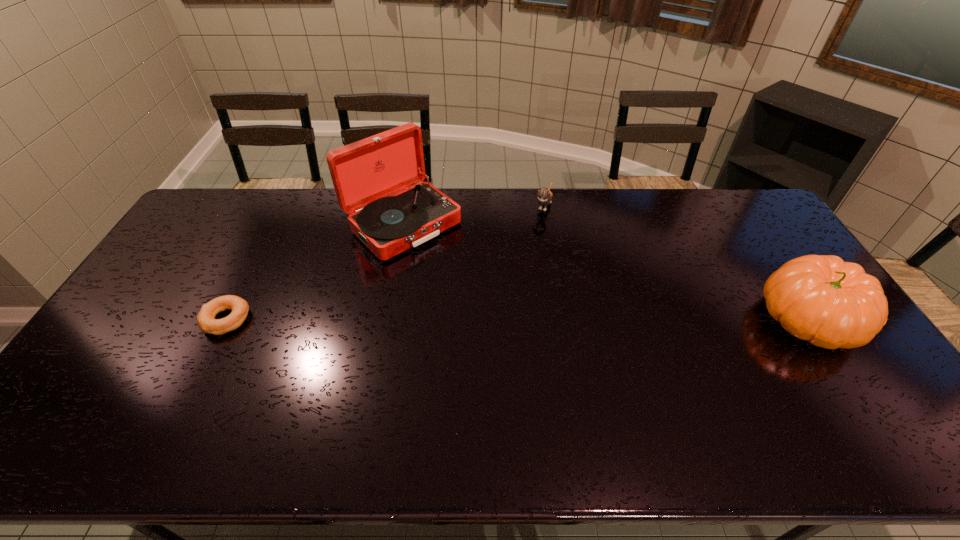
Locate an element on the screen. the leftmost object is located at coordinates (206, 320).

You are a GUI agent. You are given a task and a screenshot of the screen. Output one action in this format:
    pyautogui.click(x=<x>, y=<y>)
    Task: Click on the shortest object
    Image resolution: width=960 pixels, height=540 pixels.
    Given the screenshot: What is the action you would take?
    pyautogui.click(x=206, y=320)

Find the location of `the second tallest object`. the second tallest object is located at coordinates (832, 304).

You are a GUI agent. You are given a task and a screenshot of the screen. Output one action in this format:
    pyautogui.click(x=<x>, y=<y>)
    Task: Click on the rightmost object
    This screenshot has width=960, height=540.
    Given the screenshot: What is the action you would take?
    pyautogui.click(x=832, y=304)

You are a GUI agent. You are given a task and a screenshot of the screen. Output one action in this format:
    pyautogui.click(x=<x>, y=<y>)
    Task: Click on the second object from left to right
    The image size is (960, 540).
    Given the screenshot: What is the action you would take?
    pyautogui.click(x=364, y=173)

What are the coordinates of `the tallest object` in the screenshot? It's located at (364, 173).

Identify the location of kitten. The height and width of the screenshot is (540, 960). (545, 195).

Where is `the second object from right to left`? Image resolution: width=960 pixels, height=540 pixels. the second object from right to left is located at coordinates (545, 195).

Where is `free spot located on the left of the shortest object`? This screenshot has height=540, width=960. free spot located on the left of the shortest object is located at coordinates (136, 320).

Where is `vacant space located on the front-facing side of the tallest object`? The image size is (960, 540). vacant space located on the front-facing side of the tallest object is located at coordinates (502, 312).